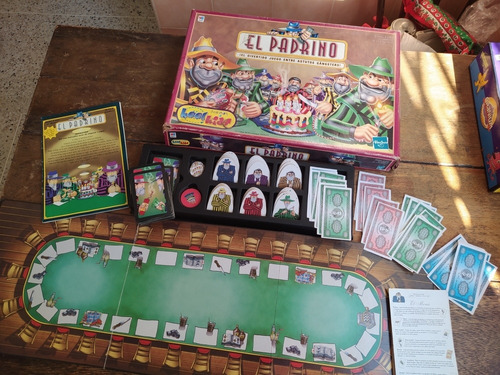
Where is `board game`? This screenshot has width=500, height=375. board game is located at coordinates (221, 299).